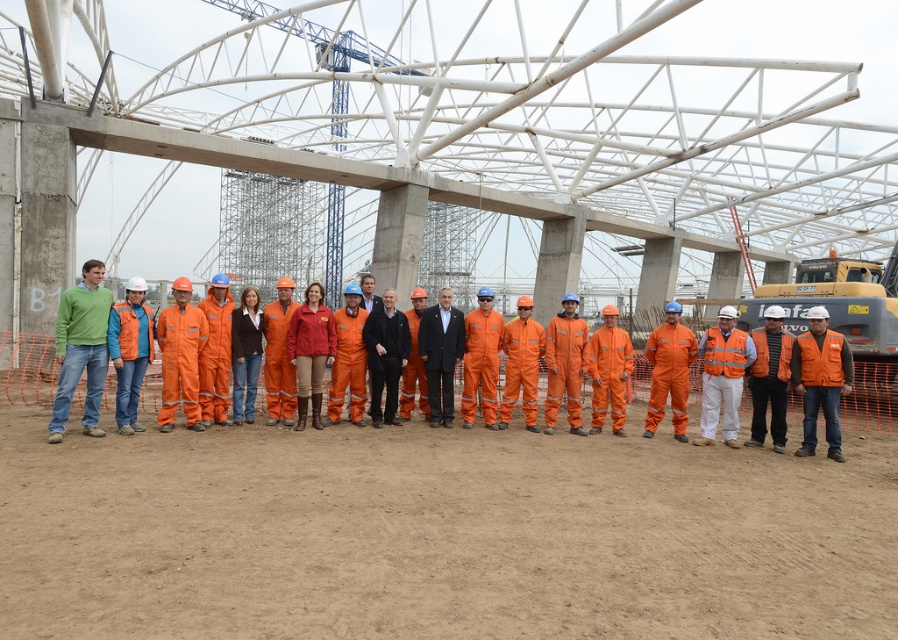
Is orange uniform at center wider than orange reflective vest at center?

Indeed, orange uniform at center has a greater width compared to orange reflective vest at center.

Is point (256, 362) farther from viewer compared to point (832, 419)?

That is True.

What are the coordinates of `orange uniform at center` in the screenshot? It's located at 307,381.